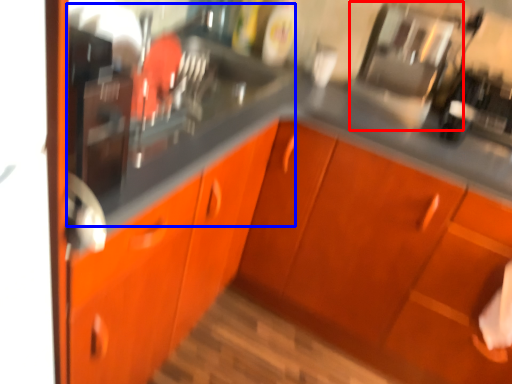
Question: Which point is closer to the camera, appliance (highlighted by a red box) or sink (highlighted by a blue box)?

Choices:
 (A) appliance
 (B) sink

Answer: (B)